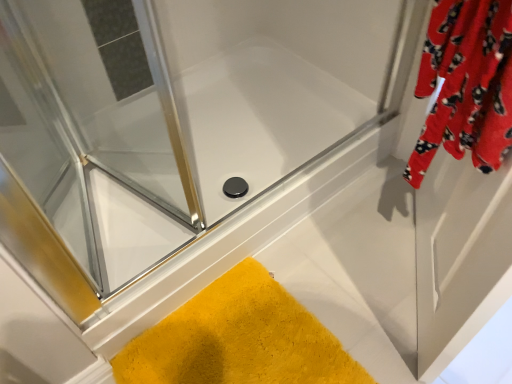
Question: Are transparent glass shower door at upper left, which is the 2th screen door from right to left, and velvet red robe at upper right, positioned as the 2th screen door in left-to-right order, far apart?

Choices:
 (A) no
 (B) yes

Answer: (A)

Question: Is transparent glass shower door at upper left, the first screen door positioned from the left, not inside velvet red robe at upper right, positioned as the 2th screen door in left-to-right order?

Choices:
 (A) no
 (B) yes

Answer: (B)

Question: Considering the relative sizes of transparent glass shower door at upper left, the first screen door positioned from the left, and velvet red robe at upper right, which appears as the 1th screen door when viewed from the right, in the image provided, is transparent glass shower door at upper left, the first screen door positioned from the left, shorter than velvet red robe at upper right, which appears as the 1th screen door when viewed from the right,?

Choices:
 (A) yes
 (B) no

Answer: (A)

Question: Considering the relative sizes of transparent glass shower door at upper left, the first screen door positioned from the left, and velvet red robe at upper right, which appears as the 1th screen door when viewed from the right, in the image provided, is transparent glass shower door at upper left, the first screen door positioned from the left, taller than velvet red robe at upper right, which appears as the 1th screen door when viewed from the right,?

Choices:
 (A) no
 (B) yes

Answer: (A)

Question: Is transparent glass shower door at upper left, the first screen door positioned from the left, closer to camera compared to velvet red robe at upper right, positioned as the 2th screen door in left-to-right order?

Choices:
 (A) no
 (B) yes

Answer: (A)

Question: Would you say transparent glass shower door at upper left, the first screen door positioned from the left, contains velvet red robe at upper right, which appears as the 1th screen door when viewed from the right?

Choices:
 (A) yes
 (B) no

Answer: (B)

Question: Does transparent glass shower door at upper left, which is the 2th screen door from right to left, have a lesser height compared to yellow fuzzy bath mat at lower left?

Choices:
 (A) yes
 (B) no

Answer: (B)

Question: Is transparent glass shower door at upper left, the first screen door positioned from the left, oriented away from yellow fuzzy bath mat at lower left?

Choices:
 (A) no
 (B) yes

Answer: (A)

Question: From a real-world perspective, is transparent glass shower door at upper left, which is the 2th screen door from right to left, located higher than yellow fuzzy bath mat at lower left?

Choices:
 (A) no
 (B) yes

Answer: (B)

Question: Does transparent glass shower door at upper left, the first screen door positioned from the left, appear on the right side of yellow fuzzy bath mat at lower left?

Choices:
 (A) yes
 (B) no

Answer: (B)

Question: Is transparent glass shower door at upper left, the first screen door positioned from the left, aimed at yellow fuzzy bath mat at lower left?

Choices:
 (A) no
 (B) yes

Answer: (A)

Question: Is transparent glass shower door at upper left, the first screen door positioned from the left, directly adjacent to yellow fuzzy bath mat at lower left?

Choices:
 (A) no
 (B) yes

Answer: (A)

Question: From the image's perspective, is yellow fuzzy bath mat at lower left beneath transparent glass shower door at upper left, which is the 2th screen door from right to left?

Choices:
 (A) no
 (B) yes

Answer: (B)